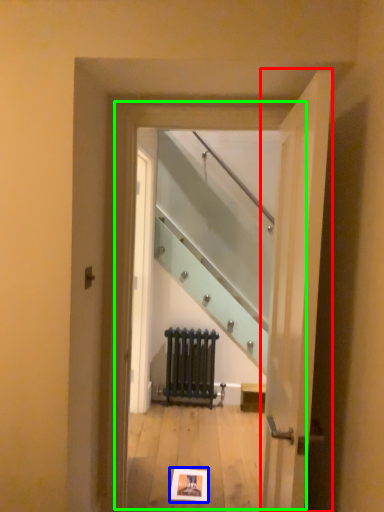
Question: Which object is the farthest from door (highlighted by a red box)? Choose among these: postcard (highlighted by a blue box) or glass door (highlighted by a green box).

Choices:
 (A) postcard
 (B) glass door

Answer: (A)